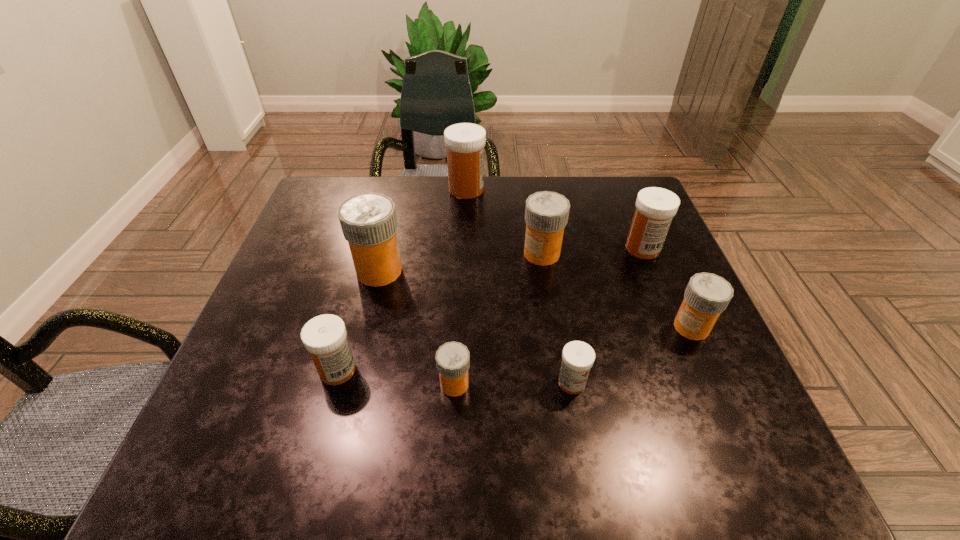
This screenshot has width=960, height=540. Find the location of `free spot at the near right corner of the desktop`. free spot at the near right corner of the desktop is located at coordinates (674, 444).

Image resolution: width=960 pixels, height=540 pixels. I want to click on free space that is in between the second biggest orange medicine and the third farthest orange medicine, so click(x=616, y=291).

Find the location of a particular element. unoccupied area between the second farthest white medicine and the third orange medicine from left to right is located at coordinates (592, 251).

Find the location of a particular element. The image size is (960, 540). free point between the second orange medicine from right to left and the farthest white medicine is located at coordinates (504, 221).

Identify the location of free spot between the third orange medicine from right to left and the second smallest white medicine. (396, 377).

This screenshot has height=540, width=960. Find the location of `free space between the third orange medicine from left to right and the farthest object`. free space between the third orange medicine from left to right and the farthest object is located at coordinates (504, 221).

At what (x,y) coordinates should I click in order to perform the action: click on free point between the smallest orange medicine and the third smallest orange medicine. Please return your answer as a coordinate pair (x, y). This screenshot has width=960, height=540. Looking at the image, I should click on (498, 319).

You are a GUI agent. You are given a task and a screenshot of the screen. Output one action in this format:
    pyautogui.click(x=<x>, y=<y>)
    Task: Click on the blank region between the biggest white medicine and the smallest white medicine
    The height and width of the screenshot is (540, 960).
    Given the screenshot: What is the action you would take?
    pyautogui.click(x=519, y=286)

Locate an element on the screen. free spot between the third biggest orange medicine and the rightmost white medicine is located at coordinates (667, 288).

Locate an element on the screen. The image size is (960, 540). free space that is in between the rightmost white medicine and the leftmost orange medicine is located at coordinates (511, 260).